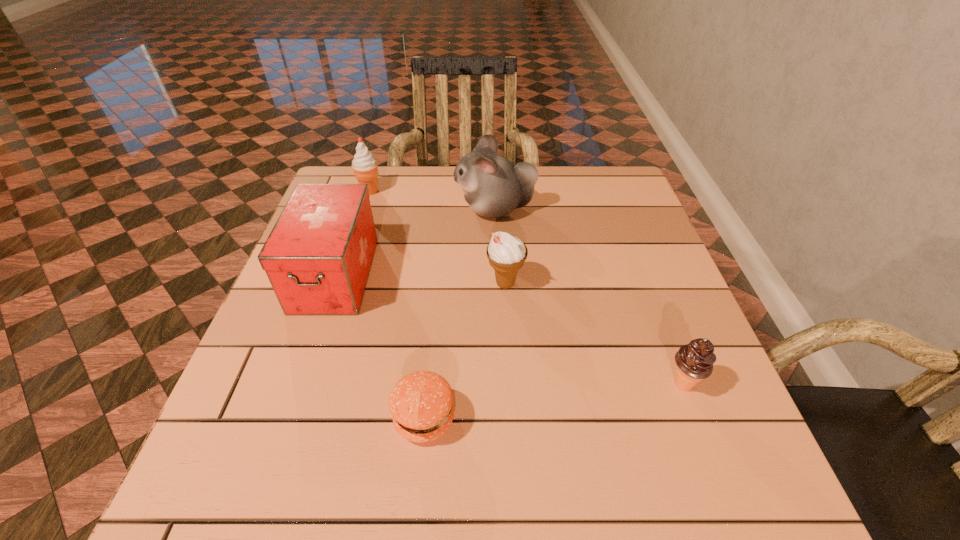
Locate an element on the screen. This screenshot has height=540, width=960. free space that satisfies the following two spatial constraints: 1. on the handle side of the shortest icecream; 2. on the right side of the first-aid kit is located at coordinates (298, 384).

Where is `free location that satisfies the following two spatial constraints: 1. on the face of the hamster; 2. on the right side of the second icecream from right to left`? free location that satisfies the following two spatial constraints: 1. on the face of the hamster; 2. on the right side of the second icecream from right to left is located at coordinates tap(498, 284).

Identify the location of free location that satisfies the following two spatial constraints: 1. on the handle side of the first-aid kit; 2. on the right side of the nearest icecream. (298, 384).